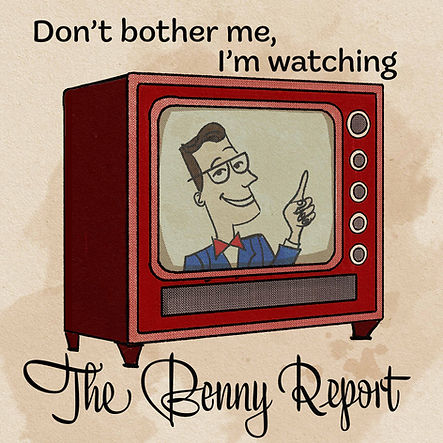
At what (x,y) coordinates should I click in order to perform the action: click on television screen. Please return your answer as a coordinate pair (x, y). Looking at the image, I should click on (304, 141).